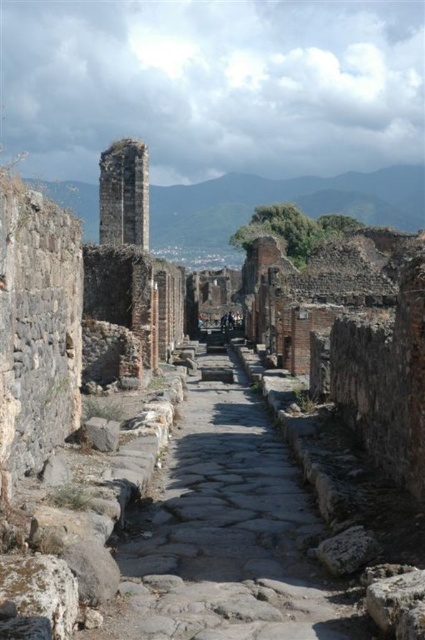
Does gray stone path at center have a larger size compared to rusty stone tower at upper left?

Indeed, gray stone path at center has a larger size compared to rusty stone tower at upper left.

Between gray stone path at center and rusty stone tower at upper left, which one appears on the left side from the viewer's perspective?

rusty stone tower at upper left is more to the left.

Where is `gray stone path at center`? gray stone path at center is located at coordinates (226, 538).